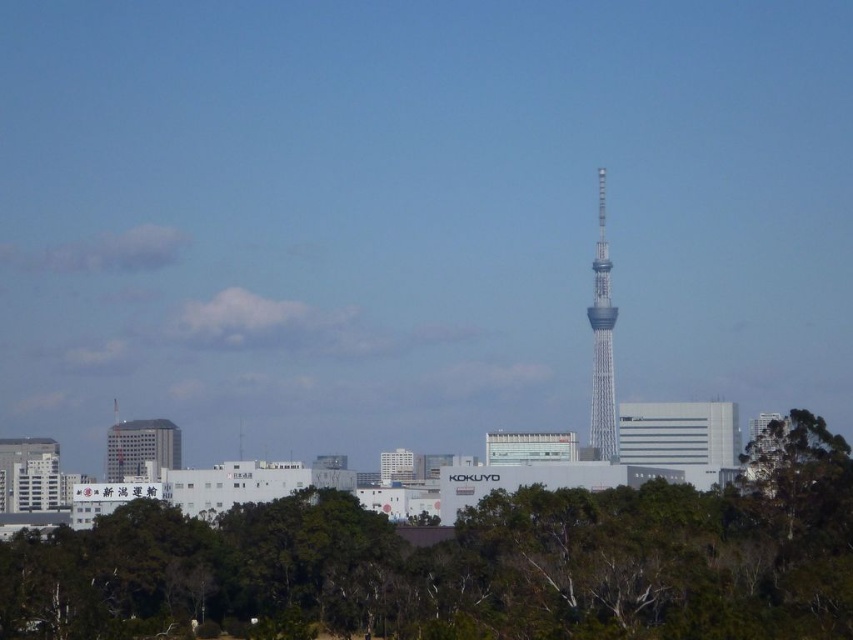
Based on the photo, you are standing in front of the Tokyo Skytree and looking at two points marked in the image. The first point is at coordinates point (x=90, y=564) and the second is at point (x=595, y=246). Which point is closer to you?

Point (x=90, y=564) is further to the camera than point (x=595, y=246), so the second point is closer to you.

Consider the image. What does the point at coordinates (602, 340) represent in the cityscape?

The point at coordinates (602, 340) indicates the location of the white glass tower at center.

You are a tourist visiting Tokyo and want to take a photo of the white glass tower at center. However, there are green leafy trees at lower center blocking your view. Can you still see the tower through the trees?

The green leafy trees at lower center are bigger than the white glass tower at center, so they might block the view of the tower. You might need to move to a different position to get a clear shot of the white glass tower at center.